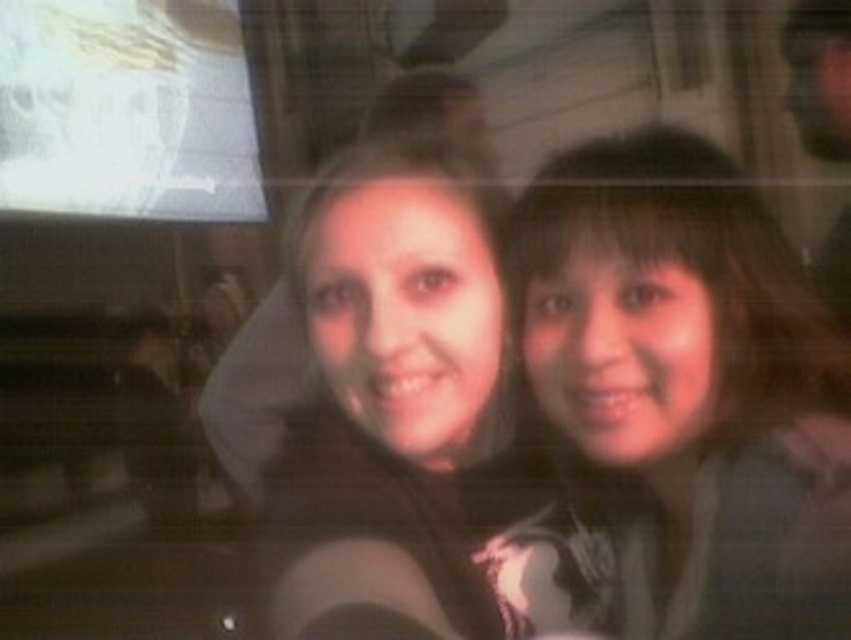
Is point (690, 337) positioned before point (849, 241)?

That is True.

Is smooth brown hair at right positioned at the back of smooth brown hair at upper right?

No, smooth brown hair at right is closer to the viewer.

Does point (774, 540) come farther from viewer compared to point (844, 157)?

No, (774, 540) is closer to viewer.

Identify the location of smooth brown hair at right. Image resolution: width=851 pixels, height=640 pixels. (675, 404).